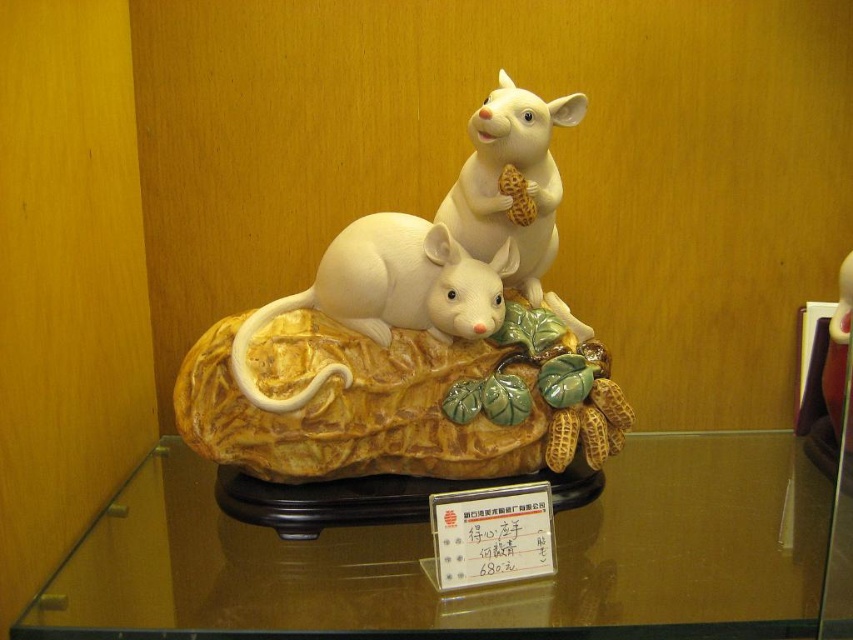
Question: Which object is positioned closest to the white glossy mouse at center?

Choices:
 (A) transparent glass table at center
 (B) white glossy mouse at upper center

Answer: (B)

Question: Observing the image, what is the correct spatial positioning of transparent glass table at center in reference to white glossy mice at center?

Choices:
 (A) left
 (B) right

Answer: (B)

Question: Can you confirm if transparent glass table at center is positioned to the left of white glossy mouse at center?

Choices:
 (A) no
 (B) yes

Answer: (A)

Question: Which point is farther from the camera taking this photo?

Choices:
 (A) (550, 224)
 (B) (677, 632)
 (C) (374, 266)
 (D) (566, 336)

Answer: (D)

Question: Is white glossy mice at center thinner than white glossy mouse at center?

Choices:
 (A) no
 (B) yes

Answer: (A)

Question: Estimate the real-world distances between objects in this image. Which object is closer to the white glossy mouse at center?

Choices:
 (A) white glossy mice at center
 (B) transparent glass table at center

Answer: (A)